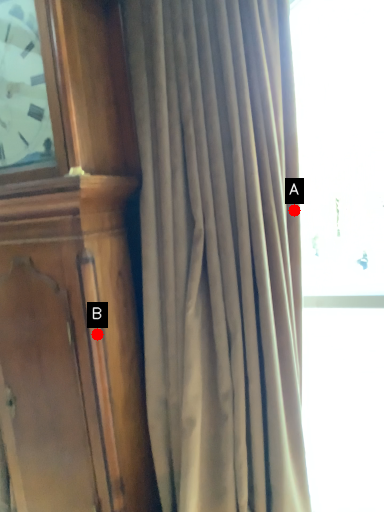
Question: Two points are circled on the image, labeled by A and B beside each circle. Which point is closer to the camera taking this photo?

Choices:
 (A) A is closer
 (B) B is closer

Answer: (B)